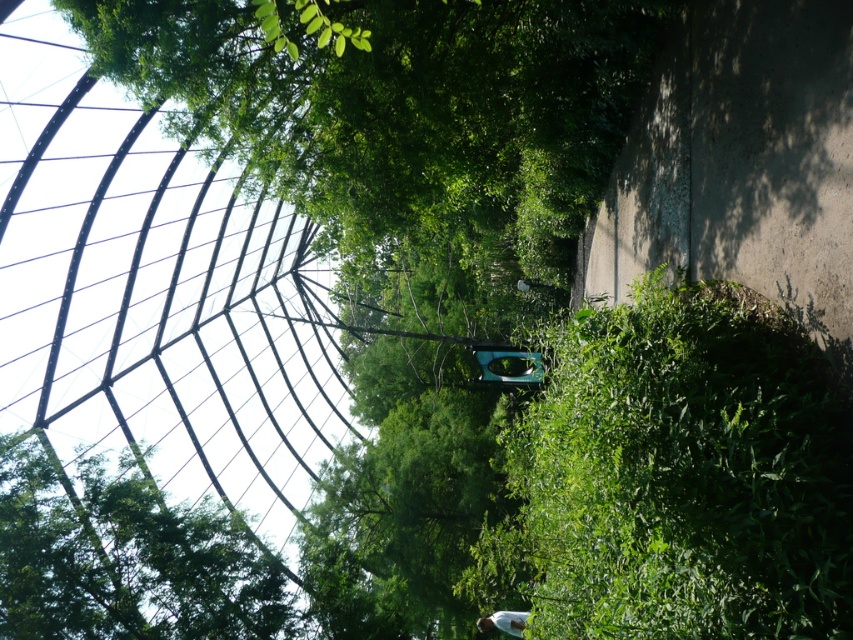
Who is higher up, green leafy tree at upper center or green leafy tree at upper left?

green leafy tree at upper center is above.

Identify the location of green leafy tree at upper center. This screenshot has height=640, width=853. (410, 132).

Who is lower down, green leafy tree at upper left or white matte shirt at lower center?

white matte shirt at lower center

Does point (199, 524) come closer to viewer compared to point (512, 625)?

No, (199, 524) is further to viewer.

Find the location of `green leafy tree at upper left`. green leafy tree at upper left is located at coordinates (123, 560).

From the picture: Does green leafy tree at upper center have a smaller size compared to white matte shirt at lower center?

Incorrect, green leafy tree at upper center is not smaller in size than white matte shirt at lower center.

Find the location of a particular element. green leafy tree at upper center is located at coordinates (410, 132).

I want to click on green leafy tree at upper center, so click(410, 132).